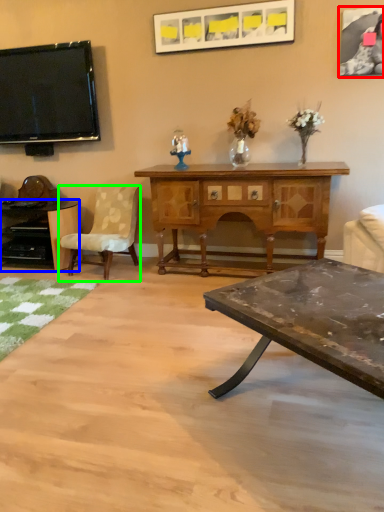
Question: Which is nearer to the picture frame (highlighted by a red box)? desk (highlighted by a blue box) or chair (highlighted by a green box).

Choices:
 (A) desk
 (B) chair

Answer: (B)